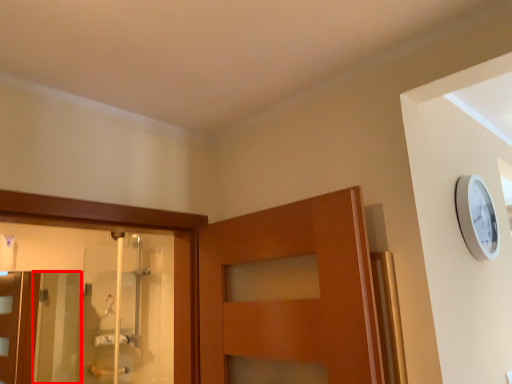
Question: Considering the relative positions of screen door (annotated by the red box) and screen door in the image provided, where is screen door (annotated by the red box) located with respect to the staircase?

Choices:
 (A) right
 (B) left

Answer: (B)